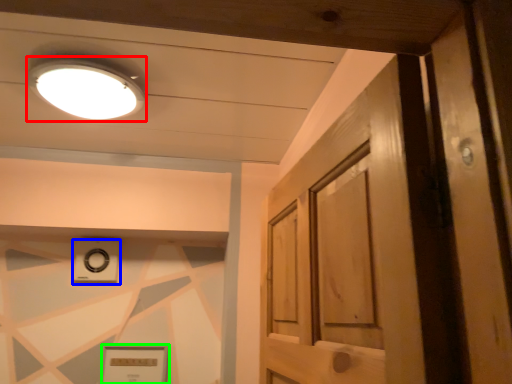
Question: Which object is the farthest from lighting (highlighted by a red box)? Choose among these: knob (highlighted by a blue box) or picture frame (highlighted by a green box).

Choices:
 (A) knob
 (B) picture frame

Answer: (B)